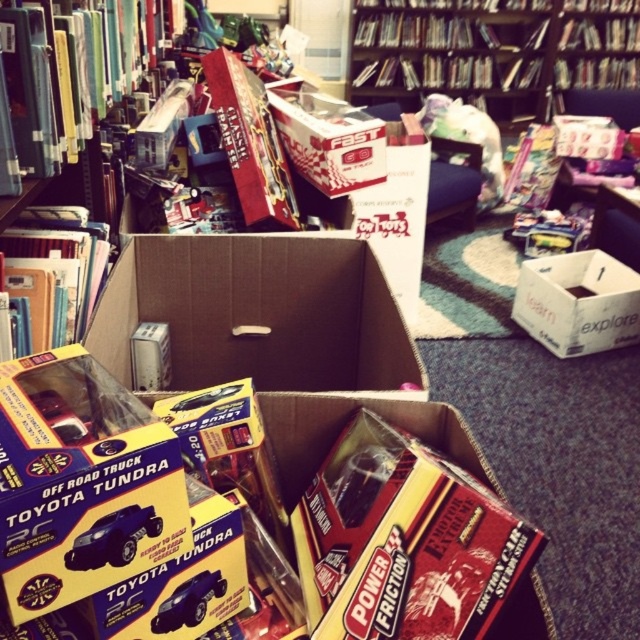
What is the location of the point labeled as coordinates (x=493, y=51) in the image?

The point labeled (x=493, y=51) is located on the wooden bookshelf at upper center.

You are standing in front of the cluttered room with the two open cardboard boxes. You see two points marked in the scene. The first point is at coordinate point (499, 49) and the second is at point (80, 260). Which point is closer to you?

Point (499, 49) is further to the camera than point (80, 260), so the point closer to you is point (80, 260).